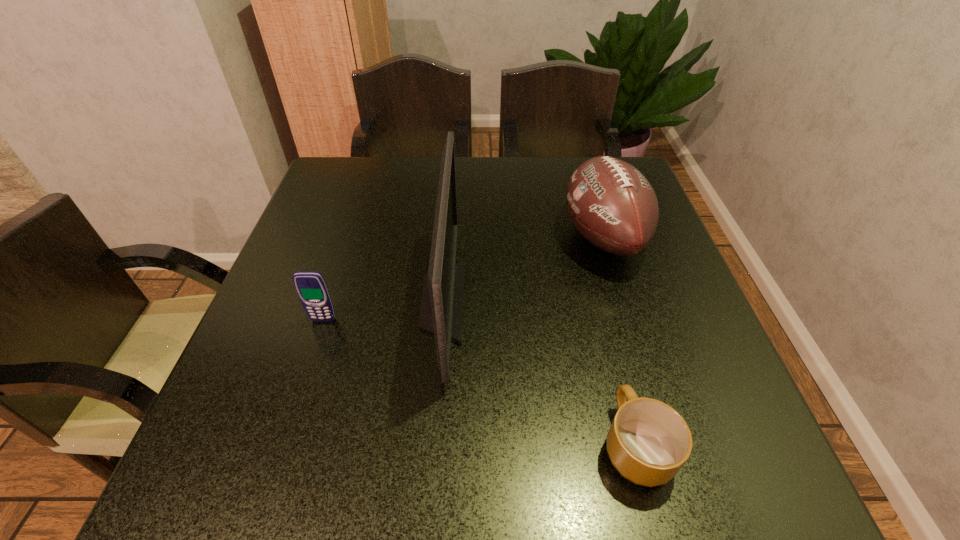
Where is `free space at the far edge of the desktop`? Image resolution: width=960 pixels, height=540 pixels. free space at the far edge of the desktop is located at coordinates (566, 181).

Identify the location of free space at the near edge of the desktop. This screenshot has width=960, height=540. point(526,460).

Locate an element on the screen. This screenshot has width=960, height=540. blank space at the left edge of the desktop is located at coordinates (305, 373).

Where is `free region at the right edge`? This screenshot has width=960, height=540. free region at the right edge is located at coordinates (705, 399).

Find the location of a particular element. The width and height of the screenshot is (960, 540). vacant space at the far left corner of the desktop is located at coordinates (361, 156).

I want to click on free space between the mug and the cellular telephone, so click(479, 382).

This screenshot has width=960, height=540. In order to click on vacant space that is in between the third shortest object and the tallest object in this screenshot , I will do `click(522, 269)`.

Find the location of `vacant space that is in between the second object from left to right and the football (American)`. vacant space that is in between the second object from left to right and the football (American) is located at coordinates (522, 269).

Find the location of a particular element. unoccupied area between the football (American) and the shortest object is located at coordinates (619, 341).

Where is `vacant area that lies between the shortest object and the football (American)`? The width and height of the screenshot is (960, 540). vacant area that lies between the shortest object and the football (American) is located at coordinates (619, 341).